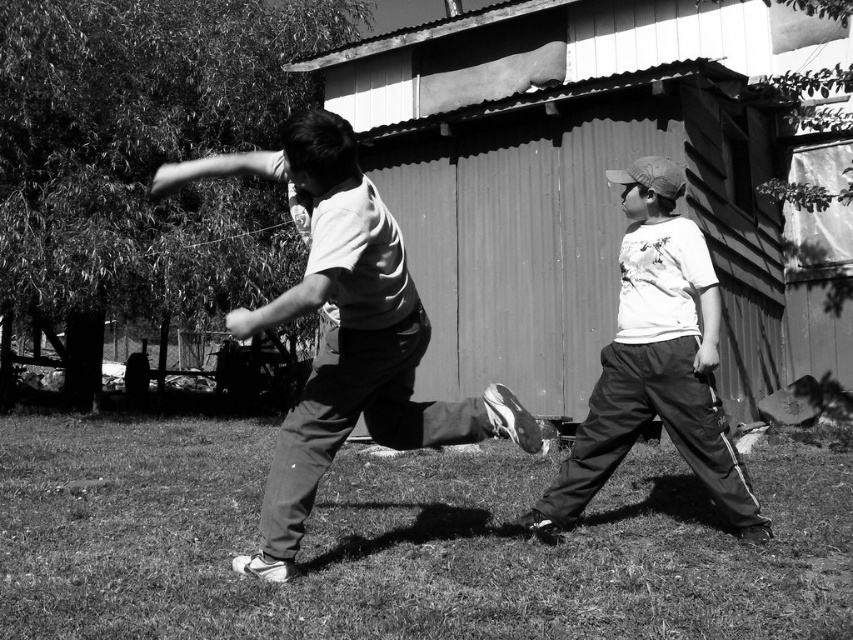
Question: Does matte white shirt at center appear over white matte shirt at center?

Choices:
 (A) yes
 (B) no

Answer: (B)

Question: Where is green grass at center located in relation to matte white shirt at center in the image?

Choices:
 (A) left
 (B) right

Answer: (B)

Question: Among these points, which one is farthest from the camera?

Choices:
 (A) (721, 472)
 (B) (339, 518)

Answer: (B)

Question: Can you confirm if matte white shirt at center is wider than white matte shirt at center?

Choices:
 (A) yes
 (B) no

Answer: (A)

Question: Which point is closer to the camera?

Choices:
 (A) green grass at center
 (B) matte white shirt at center

Answer: (B)

Question: Which point is farther to the camera?

Choices:
 (A) (347, 298)
 (B) (691, 340)

Answer: (B)